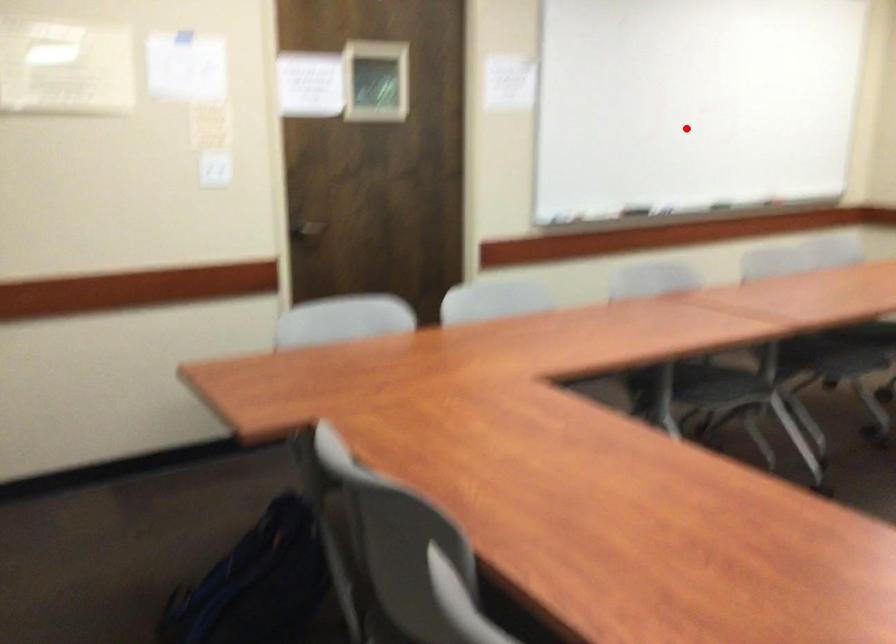
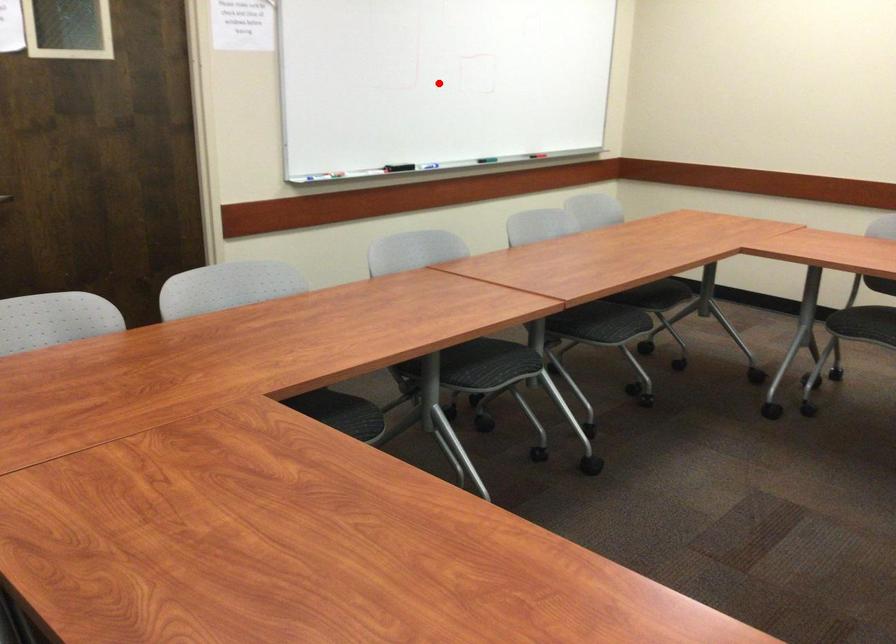
I am providing you with two images of the same scene from different viewpoints. A red point is marked on the first image and another point is marked on the second image. Do the highlighted points in image1 and image2 indicate the same real-world spot?

No